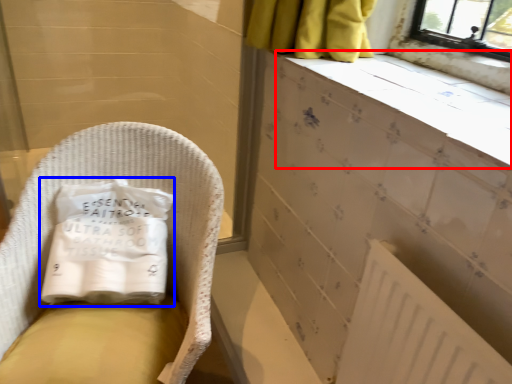
Question: Which point is closer to the camera, ledge (highlighted by a red box) or material (highlighted by a blue box)?

Choices:
 (A) ledge
 (B) material

Answer: (A)